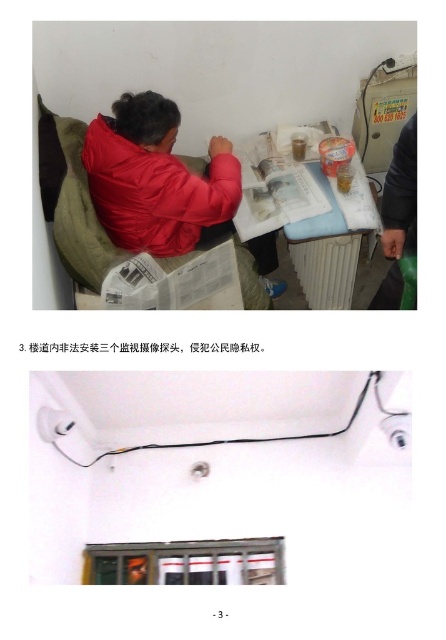
You are standing in the room and want to pick up an object that is closer to you. Which point should you go to, point (161,211) or point (379,284)?

Point (161,211) is closer to the camera than point (379,284), so you should go to point (161,211).

You are a visitor in a waiting area and see the white plastic table at upper center and the matte black jacket at upper left. Which object is closer to you?

The white plastic table at upper center is closer to you because the matte black jacket at upper left is behind it.

You are a person who wants to take the matte black jacket at upper left from the scene. Can you reach it without moving the matte red jacket at center?

The matte red jacket at center is positioned over the matte black jacket at upper left, so you cannot reach the matte black jacket at upper left without moving the matte red jacket at center.